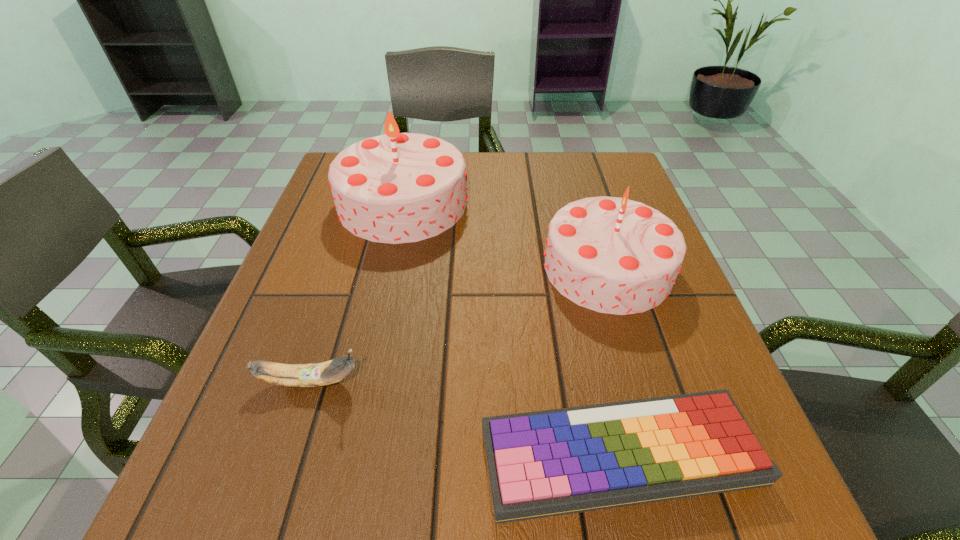
At what (x,y) coordinates should I click in order to perform the action: click on the tallest object. Please return your answer as a coordinate pair (x, y). This screenshot has width=960, height=540. Looking at the image, I should click on (395, 188).

Identify the location of the left birthday cake. (395, 188).

Find the location of a particular element. the shorter birthday cake is located at coordinates (613, 255).

The height and width of the screenshot is (540, 960). What are the coordinates of `the right birthday cake` in the screenshot? It's located at (613, 255).

Identify the location of the third tallest object. (324, 373).

Locate an element on the screen. the third farthest object is located at coordinates (324, 373).

The width and height of the screenshot is (960, 540). Find the location of `the nearest object`. the nearest object is located at coordinates (546, 463).

Where is `the shortest object`? the shortest object is located at coordinates (546, 463).

Where is `vacant space located 0.180m on the right of the tallest object`? This screenshot has width=960, height=540. vacant space located 0.180m on the right of the tallest object is located at coordinates (543, 203).

I want to click on free space located 0.080m on the front of the right birthday cake, so click(x=634, y=352).